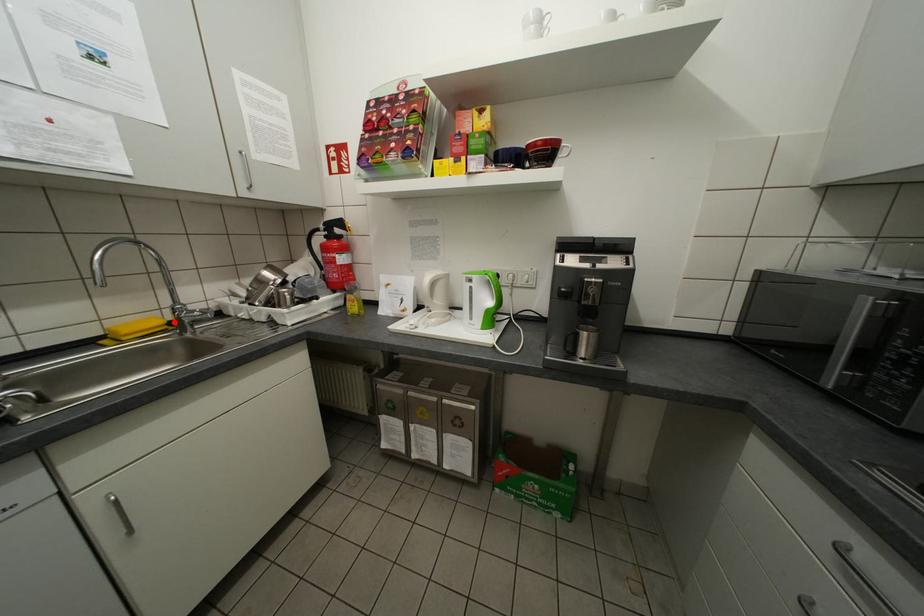
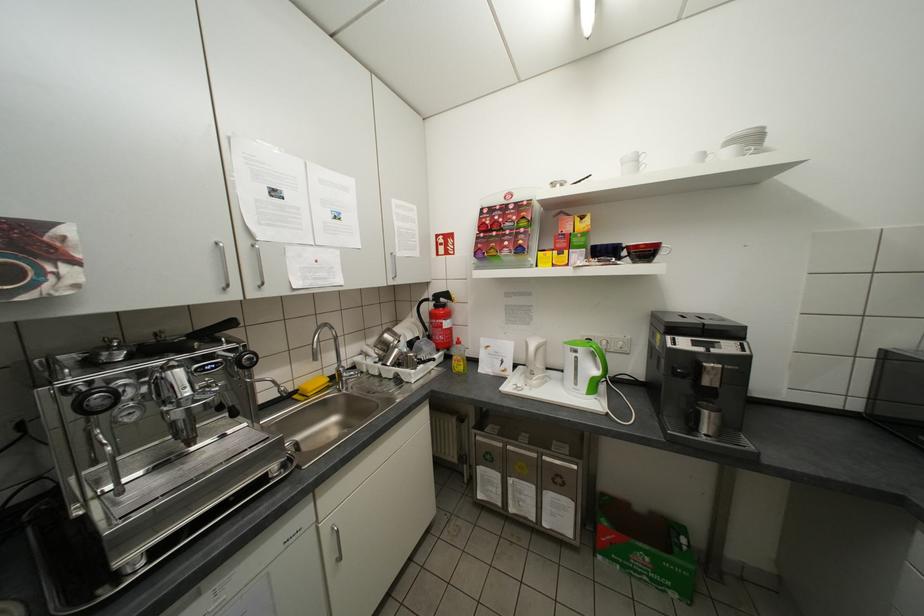
In the second image, find the point that corresponds to the highlighted location in the first image.

(336, 379)